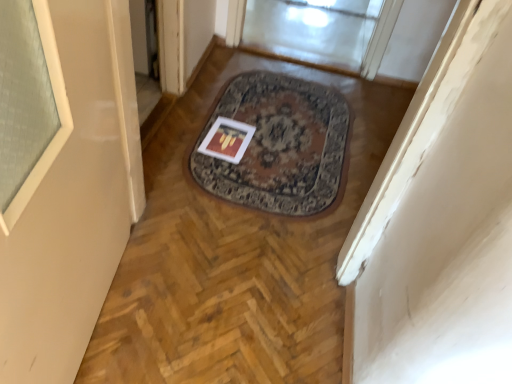
Question: From a real-world perspective, relative to transparent glass door at upper center, is matte paper postcard at center vertically above or below?

Choices:
 (A) below
 (B) above

Answer: (A)

Question: Looking at the image, does matte paper postcard at center seem bigger or smaller compared to transparent glass door at upper center?

Choices:
 (A) big
 (B) small

Answer: (B)

Question: Considering the positions of matte paper postcard at center and transparent glass door at upper center in the image, is matte paper postcard at center taller or shorter than transparent glass door at upper center?

Choices:
 (A) short
 (B) tall

Answer: (A)

Question: From their relative heights in the image, would you say transparent glass door at upper center is taller or shorter than matte paper postcard at center?

Choices:
 (A) tall
 (B) short

Answer: (A)

Question: Based on their sizes in the image, would you say transparent glass door at upper center is bigger or smaller than matte paper postcard at center?

Choices:
 (A) small
 (B) big

Answer: (B)

Question: Would you say transparent glass door at upper center is to the left or to the right of matte paper postcard at center in the picture?

Choices:
 (A) left
 (B) right

Answer: (B)

Question: In the image, is transparent glass door at upper center positioned in front of or behind matte paper postcard at center?

Choices:
 (A) front
 (B) behind

Answer: (B)